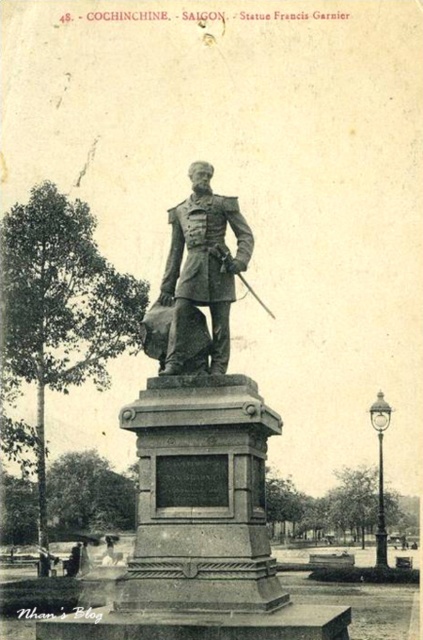
Between bronze statue at center and bronze/golden statue at center, which one is positioned higher?

bronze/golden statue at center is above.

Is bronze statue at center bigger than bronze/golden statue at center?

Yes.

Is point (167, 444) behind point (176, 337)?

No, (167, 444) is closer to viewer.

This screenshot has height=640, width=423. In order to click on bronze statue at center in this screenshot , I will do `click(202, 435)`.